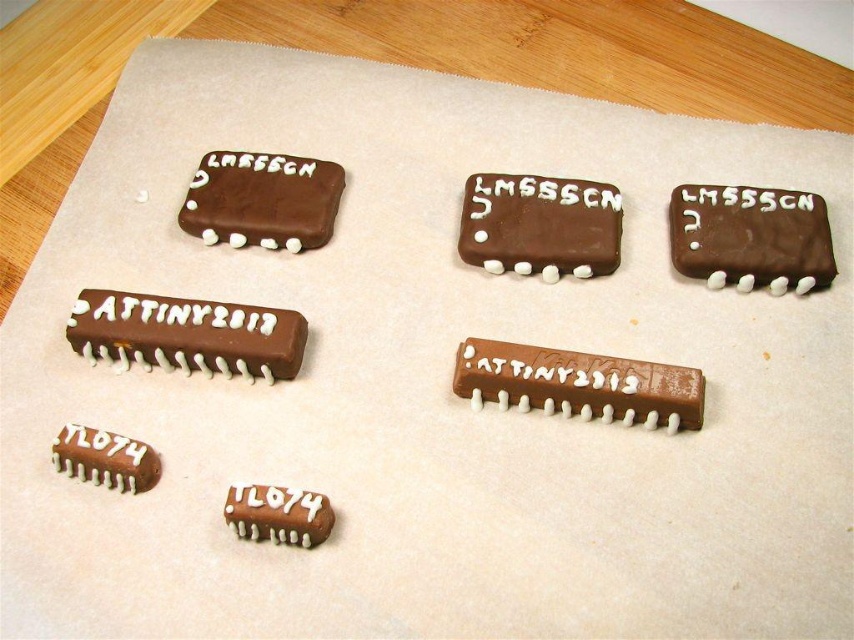
Who is positioned more to the right, chocolatesmoothattiny2312 at center or matte brown chip at bottom left?

chocolatesmoothattiny2312 at center is more to the right.

Does chocolatesmoothattiny2312 at center have a lesser height compared to matte brown chip at bottom left?

In fact, chocolatesmoothattiny2312 at center may be taller than matte brown chip at bottom left.

Does point (677, 412) lie in front of point (161, 470)?

That is True.

Find the location of a particular element. Image resolution: width=854 pixels, height=640 pixels. chocolatesmoothattiny2312 at center is located at coordinates (578, 384).

Between point (151, 348) and point (232, 492), which one is positioned behind?

The point (151, 348) is more distant.

Does point (184, 316) come in front of point (322, 497)?

No, (184, 316) is behind (322, 497).

Where is `matte chocolate chip at lower left`? This screenshot has height=640, width=854. matte chocolate chip at lower left is located at coordinates (186, 333).

The width and height of the screenshot is (854, 640). Describe the element at coordinates (186, 333) in the screenshot. I see `matte chocolate chip at lower left` at that location.

Does matte chocolate chip at lower left lie in front of chocolatesmoothintegrated circuit at upper right?

No.

Is point (206, 353) positioned in front of point (758, 269)?

Yes, point (206, 353) is closer to viewer.

Where is `matte chocolate chip at lower left`? The height and width of the screenshot is (640, 854). matte chocolate chip at lower left is located at coordinates (186, 333).